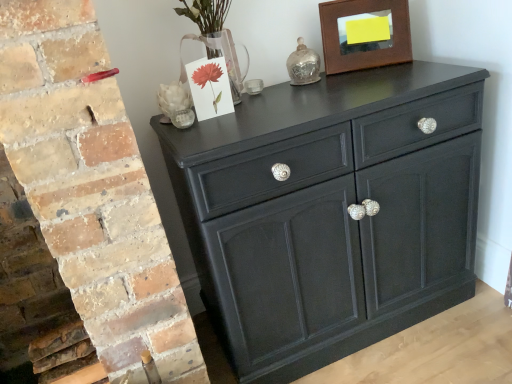
Question: Is white matte sculpture at upper left wider or thinner than matte black cabinet at center?

Choices:
 (A) wide
 (B) thin

Answer: (B)

Question: Is white matte sculpture at upper left spatially inside matte black cabinet at center, or outside of it?

Choices:
 (A) outside
 (B) inside

Answer: (A)

Question: Based on their relative distances, which object is nearer to the white matte sculpture at upper left?

Choices:
 (A) brown wooden picture frame at upper right
 (B) matte black cabinet at center

Answer: (B)

Question: Based on their relative distances, which object is farther from the brown wooden picture frame at upper right?

Choices:
 (A) white matte sculpture at upper left
 (B) matte black cabinet at center

Answer: (A)